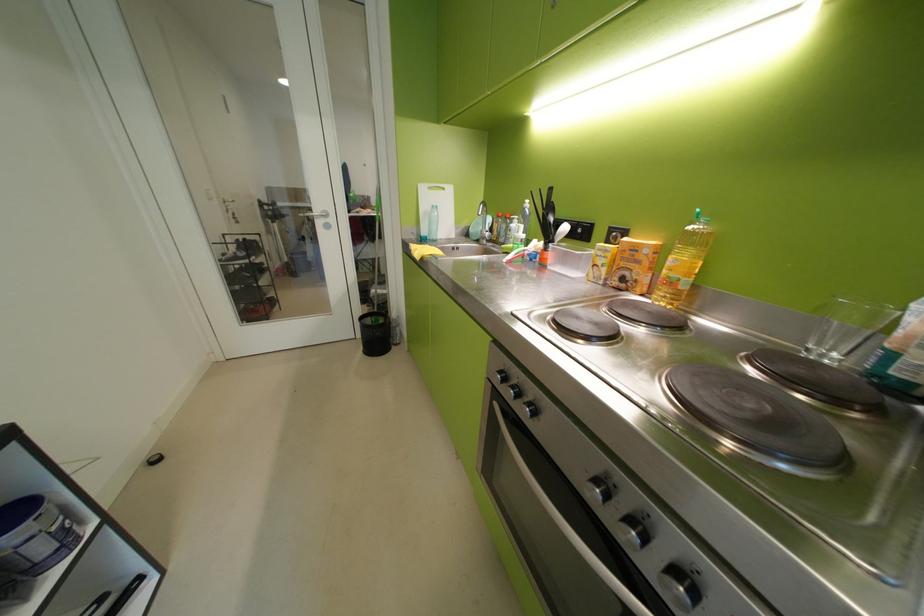
Find where to pull the silver door handle. Please return your answer as a coordinate pair (x, y).

(315, 214)